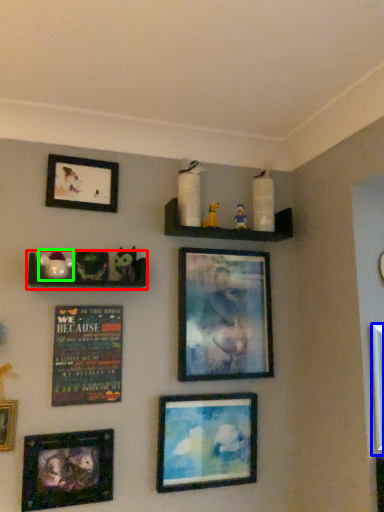
Question: Based on their relative distances, which object is nearer to shelf (highlighted by a red box)? Choose from picture frame (highlighted by a blue box) and toy (highlighted by a green box).

Choices:
 (A) picture frame
 (B) toy

Answer: (B)